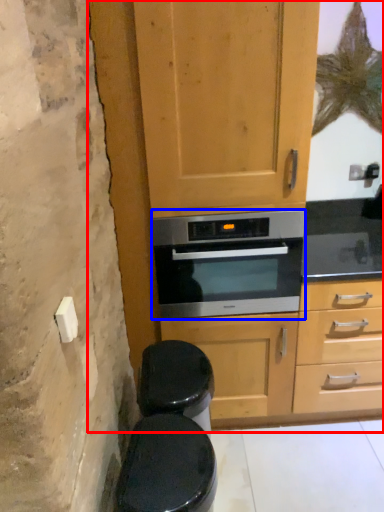
Question: Which object is further to the camera taking this photo, dresser (highlighted by a red box) or oven (highlighted by a blue box)?

Choices:
 (A) dresser
 (B) oven

Answer: (B)